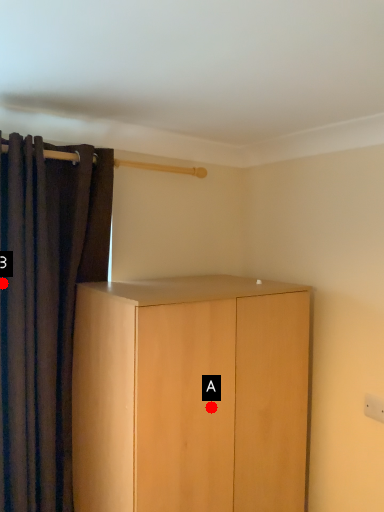
Question: Two points are circled on the image, labeled by A and B beside each circle. Which point is closer to the camera taking this photo?

Choices:
 (A) A is closer
 (B) B is closer

Answer: (A)